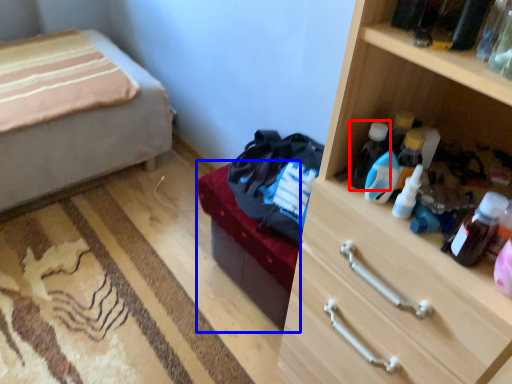
Question: Which point is further to the camera, bottle (highlighted by a red box) or bed frame (highlighted by a blue box)?

Choices:
 (A) bottle
 (B) bed frame

Answer: (B)